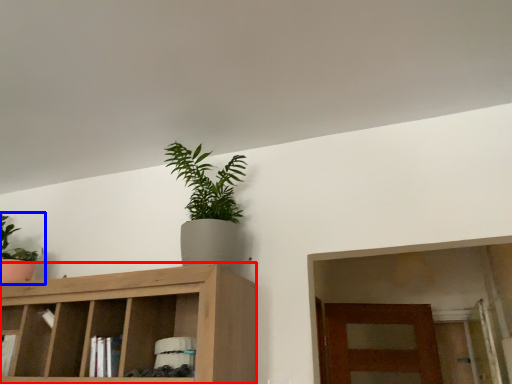
Question: Which point is further to the camera, cabinetry (highlighted by a red box) or houseplant (highlighted by a blue box)?

Choices:
 (A) cabinetry
 (B) houseplant

Answer: (B)